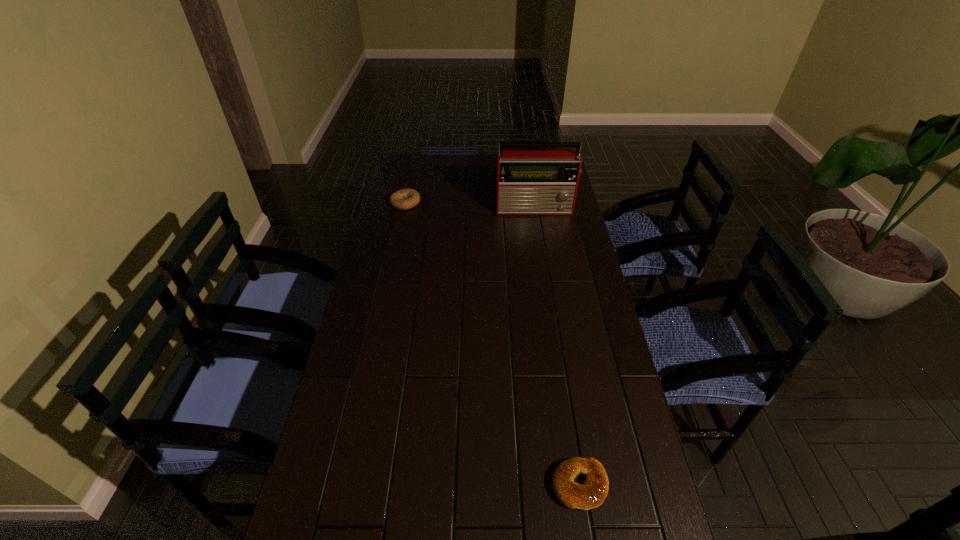
Find the location of a particular element. This screenshot has height=540, width=960. bagel that is at the right edge is located at coordinates (591, 494).

I want to click on vacant region at the far edge of the desktop, so click(461, 170).

Where is `vacant area at the left edge`? Image resolution: width=960 pixels, height=540 pixels. vacant area at the left edge is located at coordinates (301, 519).

Locate an element on the screen. vacant space at the right edge is located at coordinates 599,507.

The width and height of the screenshot is (960, 540). Find the location of `vacant space at the far left corner`. vacant space at the far left corner is located at coordinates (405, 165).

In order to click on unoccupied position between the radio receiver and the farther bagel in this screenshot , I will do `click(470, 205)`.

Locate an element on the screen. The height and width of the screenshot is (540, 960). vacant space in between the farther bagel and the tallest object is located at coordinates (470, 205).

What are the coordinates of `empty space that is in between the tallest object and the right bagel` in the screenshot? It's located at (558, 347).

The width and height of the screenshot is (960, 540). I want to click on free space that is in between the leftmost object and the nearer bagel, so click(492, 344).

Where is `free point between the tallest object and the nearest object`? Image resolution: width=960 pixels, height=540 pixels. free point between the tallest object and the nearest object is located at coordinates (558, 347).